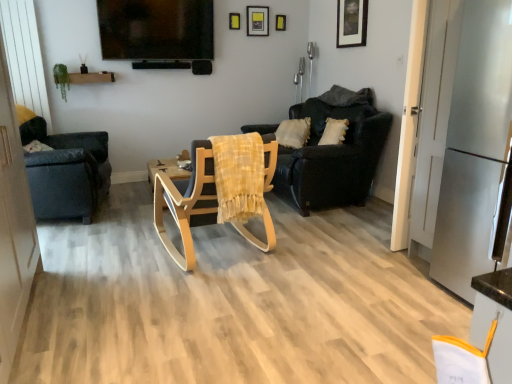
The image size is (512, 384). Describe the element at coordinates (474, 146) in the screenshot. I see `satin silver refrigerator at right` at that location.

What is the approximate height of yellow matte picture frame at upper center, which ranks as the first picture frame in left-to-right order?

yellow matte picture frame at upper center, which ranks as the first picture frame in left-to-right order, is 6.98 inches tall.

At what (x,y) coordinates should I click in order to perform the action: click on dark brown leather armchair at center, positioned as the 3th chair in left-to-right order. Please return your answer as a coordinate pair (x, y). Image resolution: width=512 pixels, height=384 pixels. Looking at the image, I should click on (333, 153).

Measure the distance between point (x=349, y=17) and camera.

The depth of point (x=349, y=17) is 4.52 meters.

The width and height of the screenshot is (512, 384). Describe the element at coordinates (257, 20) in the screenshot. I see `matte black picture frame at upper center, arranged as the 3th picture frame when viewed from the right` at that location.

This screenshot has width=512, height=384. Identify the location of satin silver refrigerator at right. (474, 146).

From a real-world perspective, is dark gray fabric chair at left, the third chair positioned from the right, positioned under matte black picture frame at upper right, which is the 4th picture frame in back-to-front order, based on gravity?

Yes, from a real-world perspective, dark gray fabric chair at left, the third chair positioned from the right, is below matte black picture frame at upper right, which is the 4th picture frame in back-to-front order.

Is point (87, 169) closer or farther from the camera than point (357, 17)?

Clearly, point (87, 169) is closer to the camera than point (357, 17).

Considering the sizes of dark gray fabric chair at left, the third chair positioned from the right, and matte black picture frame at upper right, which is counted as the 1th picture frame, starting from the right, in the image, is dark gray fabric chair at left, the third chair positioned from the right, bigger or smaller than matte black picture frame at upper right, which is counted as the 1th picture frame, starting from the right,?

dark gray fabric chair at left, the third chair positioned from the right, is bigger than matte black picture frame at upper right, which is counted as the 1th picture frame, starting from the right.

How many degrees apart are the facing directions of dark gray fabric chair at left, the third chair positioned from the right, and matte black picture frame at upper right, which appears as the fourth picture frame when viewed from the left?

The facing directions of dark gray fabric chair at left, the third chair positioned from the right, and matte black picture frame at upper right, which appears as the fourth picture frame when viewed from the left, are 165 degrees apart.

Between matte black picture frame at upper center, the third picture frame when ordered from front to back, and dark gray fabric chair at left, the third chair positioned from the right, which one is positioned behind?

matte black picture frame at upper center, the third picture frame when ordered from front to back, is more distant.

Could you measure the distance between matte black picture frame at upper center, the 2th picture frame in the back-to-front sequence, and dark gray fabric chair at left, the third chair positioned from the right?

9.12 feet.

Would you say matte black picture frame at upper center, arranged as the 3th picture frame when viewed from the right, is a long distance from dark gray fabric chair at left, placed as the 1th chair when sorted from left to right?

matte black picture frame at upper center, arranged as the 3th picture frame when viewed from the right, is far away from dark gray fabric chair at left, placed as the 1th chair when sorted from left to right.

From their relative heights in the image, would you say matte black picture frame at upper center, the 2th picture frame in the back-to-front sequence, is taller or shorter than dark gray fabric chair at left, placed as the 1th chair when sorted from left to right?

Clearly, matte black picture frame at upper center, the 2th picture frame in the back-to-front sequence, is shorter compared to dark gray fabric chair at left, placed as the 1th chair when sorted from left to right.

Does point (75, 199) appear closer or farther from the camera than point (165, 240)?

Point (75, 199).

From the image's perspective, would you say dark gray fabric chair at left, placed as the 1th chair when sorted from left to right, is positioned over wooden rocking chair at center, positioned as the second chair in right-to-left order?

Indeed, from the image's perspective, dark gray fabric chair at left, placed as the 1th chair when sorted from left to right, is shown above wooden rocking chair at center, positioned as the second chair in right-to-left order.

Which object is wider, dark gray fabric chair at left, the third chair positioned from the right, or wooden rocking chair at center, positioned as the second chair in right-to-left order?

With larger width is dark gray fabric chair at left, the third chair positioned from the right.

Is dark gray fabric chair at left, the third chair positioned from the right, aimed at wooden rocking chair at center, positioned as the second chair in right-to-left order?

No, dark gray fabric chair at left, the third chair positioned from the right, is not oriented towards wooden rocking chair at center, positioned as the second chair in right-to-left order.

Which of these two, dark gray fabric chair at left, placed as the 1th chair when sorted from left to right, or matte yellow picture frame at upper center, acting as the 3th picture frame starting from the left, stands shorter?

With less height is matte yellow picture frame at upper center, acting as the 3th picture frame starting from the left.

From a real-world perspective, relative to matte yellow picture frame at upper center, which is the 1th picture frame in back-to-front order, is dark gray fabric chair at left, the third chair positioned from the right, vertically above or below?

In terms of real-world spatial position, dark gray fabric chair at left, the third chair positioned from the right, is below matte yellow picture frame at upper center, which is the 1th picture frame in back-to-front order.

Considering the positions of points (83, 190) and (278, 20), is point (83, 190) farther from camera compared to point (278, 20)?

No, it is in front of (278, 20).

Based on the photo, how many degrees apart are the facing directions of dark gray fabric chair at left, placed as the 1th chair when sorted from left to right, and matte yellow picture frame at upper center, the second picture frame when ordered from right to left?

dark gray fabric chair at left, placed as the 1th chair when sorted from left to right, and matte yellow picture frame at upper center, the second picture frame when ordered from right to left, are facing 76.5 degrees away from each other.

From a real-world perspective, is wooden rocking chair at center, which appears as the second chair when viewed from the left, over yellow matte picture frame at upper center, which ranks as the first picture frame in left-to-right order?

No, from a real-world perspective, wooden rocking chair at center, which appears as the second chair when viewed from the left, is not above yellow matte picture frame at upper center, which ranks as the first picture frame in left-to-right order.

Is wooden rocking chair at center, positioned as the second chair in right-to-left order, further to camera compared to yellow matte picture frame at upper center, which appears as the fourth picture frame when viewed from the right?

No, it is not.

Considering the relative sizes of wooden rocking chair at center, which appears as the second chair when viewed from the left, and yellow matte picture frame at upper center, which appears as the fourth picture frame when viewed from the right, in the image provided, is wooden rocking chair at center, which appears as the second chair when viewed from the left, smaller than yellow matte picture frame at upper center, which appears as the fourth picture frame when viewed from the right,?

Incorrect, wooden rocking chair at center, which appears as the second chair when viewed from the left, is not smaller in size than yellow matte picture frame at upper center, which appears as the fourth picture frame when viewed from the right.

Considering the relative sizes of wooden rocking chair at center, which appears as the second chair when viewed from the left, and yellow matte picture frame at upper center, the 2th picture frame when ordered from front to back, in the image provided, is wooden rocking chair at center, which appears as the second chair when viewed from the left, wider than yellow matte picture frame at upper center, the 2th picture frame when ordered from front to back,?

Yes.

Can you confirm if satin silver refrigerator at right is positioned to the right of matte black picture frame at upper center, the third picture frame when ordered from front to back?

Yes, satin silver refrigerator at right is to the right of matte black picture frame at upper center, the third picture frame when ordered from front to back.

Does satin silver refrigerator at right turn towards matte black picture frame at upper center, which ranks as the 2th picture frame in left-to-right order?

No, satin silver refrigerator at right is not aimed at matte black picture frame at upper center, which ranks as the 2th picture frame in left-to-right order.

Is satin silver refrigerator at right positioned in front of matte black picture frame at upper center, the 2th picture frame in the back-to-front sequence?

Yes, it is.

In terms of width, does satin silver refrigerator at right look wider or thinner when compared to matte black picture frame at upper center, which ranks as the 2th picture frame in left-to-right order?

In the image, satin silver refrigerator at right appears to be wider than matte black picture frame at upper center, which ranks as the 2th picture frame in left-to-right order.

Considering the sizes of objects matte black picture frame at upper center, the 2th picture frame in the back-to-front sequence, and wooden rocking chair at center, positioned as the second chair in right-to-left order, in the image provided, who is taller, matte black picture frame at upper center, the 2th picture frame in the back-to-front sequence, or wooden rocking chair at center, positioned as the second chair in right-to-left order,?

With more height is wooden rocking chair at center, positioned as the second chair in right-to-left order.

From a real-world perspective, which object rests below the other?

From a 3D spatial view, wooden rocking chair at center, which appears as the second chair when viewed from the left, is below.

Looking at this image, from the image's perspective, which is above, matte black picture frame at upper center, the third picture frame when ordered from front to back, or wooden rocking chair at center, which appears as the second chair when viewed from the left?

matte black picture frame at upper center, the third picture frame when ordered from front to back, appears higher in the image.

Consider the image. In the image, is matte black picture frame at upper center, the 2th picture frame in the back-to-front sequence, on the left side or the right side of wooden rocking chair at center, positioned as the second chair in right-to-left order?

matte black picture frame at upper center, the 2th picture frame in the back-to-front sequence, is to the right of wooden rocking chair at center, positioned as the second chair in right-to-left order.

There is a matte black picture frame at upper right, which is counted as the 1th picture frame, starting from the right. At what (x,y) coordinates should I click in order to perform the action: click on the 2nd chair below it (from the image's perspective). Please return your answer as a coordinate pair (x, y). Looking at the image, I should click on (66, 172).

The image size is (512, 384). Find the location of `the 3rd picture frame behind when counting from the dark gray fabric chair at left, the third chair positioned from the right`. the 3rd picture frame behind when counting from the dark gray fabric chair at left, the third chair positioned from the right is located at coordinates (257, 20).

Which object lies further to the anchor point wooden rocking chair at center, which appears as the second chair when viewed from the left, matte yellow picture frame at upper center, the 4th picture frame positioned from the front, or yellow matte picture frame at upper center, positioned as the third picture frame in back-to-front order?

matte yellow picture frame at upper center, the 4th picture frame positioned from the front.

Estimate the real-world distances between objects in this image. Which object is closer to yellow matte picture frame at upper center, the 2th picture frame when ordered from front to back, satin silver refrigerator at right or matte black picture frame at upper right, which is the 4th picture frame in back-to-front order?

matte black picture frame at upper right, which is the 4th picture frame in back-to-front order.

Which object lies further to the anchor point yellow matte picture frame at upper center, the 2th picture frame when ordered from front to back, wooden rocking chair at center, which appears as the second chair when viewed from the left, or matte black picture frame at upper center, arranged as the 3th picture frame when viewed from the right?

Among the two, wooden rocking chair at center, which appears as the second chair when viewed from the left, is located further to yellow matte picture frame at upper center, the 2th picture frame when ordered from front to back.

Looking at this image, when comparing their distances from satin silver refrigerator at right, does matte yellow picture frame at upper center, the second picture frame when ordered from right to left, or matte black picture frame at upper center, the third picture frame when ordered from front to back, seem closer?

matte black picture frame at upper center, the third picture frame when ordered from front to back, is positioned closer to the anchor satin silver refrigerator at right.

Looking at the image, which one is located further to dark brown leather armchair at center, which is the 1th chair in right-to-left order, matte black picture frame at upper right, which appears as the 1th picture frame when viewed from the front, or matte black picture frame at upper center, which ranks as the 2th picture frame in left-to-right order?

matte black picture frame at upper center, which ranks as the 2th picture frame in left-to-right order, is positioned further to the anchor dark brown leather armchair at center, which is the 1th chair in right-to-left order.

When comparing their distances from matte black picture frame at upper center, the 2th picture frame in the back-to-front sequence, does matte black picture frame at upper right, which appears as the 1th picture frame when viewed from the front, or satin silver refrigerator at right seem further?

Based on the image, satin silver refrigerator at right appears to be further to matte black picture frame at upper center, the 2th picture frame in the back-to-front sequence.

Looking at the image, which one is located closer to wooden rocking chair at center, positioned as the second chair in right-to-left order, matte black picture frame at upper center, arranged as the 3th picture frame when viewed from the right, or yellow matte picture frame at upper center, which appears as the fourth picture frame when viewed from the right?

Based on the image, yellow matte picture frame at upper center, which appears as the fourth picture frame when viewed from the right, appears to be nearer to wooden rocking chair at center, positioned as the second chair in right-to-left order.

Which object lies further to the anchor point dark gray fabric chair at left, placed as the 1th chair when sorted from left to right, dark brown leather armchair at center, which is the 1th chair in right-to-left order, or wooden rocking chair at center, which appears as the second chair when viewed from the left?

Based on the image, dark brown leather armchair at center, which is the 1th chair in right-to-left order, appears to be further to dark gray fabric chair at left, placed as the 1th chair when sorted from left to right.

Find the location of a particular element. The image size is (512, 384). picture frame between satin silver refrigerator at right and yellow matte picture frame at upper center, the 2th picture frame when ordered from front to back, from front to back is located at coordinates (351, 23).

At what (x,y) coordinates should I click in order to perform the action: click on picture frame that lies between yellow matte picture frame at upper center, which ranks as the first picture frame in left-to-right order, and dark brown leather armchair at center, which is the 1th chair in right-to-left order, from top to bottom. Please return your answer as a coordinate pair (x, y). This screenshot has height=384, width=512. Looking at the image, I should click on (351, 23).

At what (x,y) coordinates should I click in order to perform the action: click on picture frame between wooden rocking chair at center, positioned as the second chair in right-to-left order, and yellow matte picture frame at upper center, positioned as the third picture frame in back-to-front order, along the z-axis. Please return your answer as a coordinate pair (x, y). Looking at the image, I should click on (351, 23).

This screenshot has width=512, height=384. I want to click on picture frame situated between dark gray fabric chair at left, placed as the 1th chair when sorted from left to right, and matte black picture frame at upper center, the 2th picture frame in the back-to-front sequence, from left to right, so click(x=234, y=21).